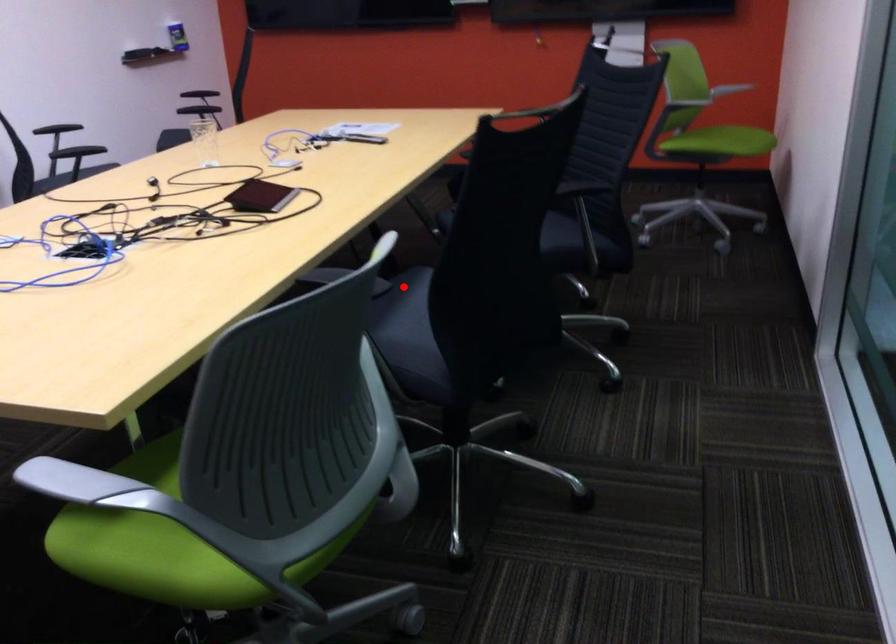
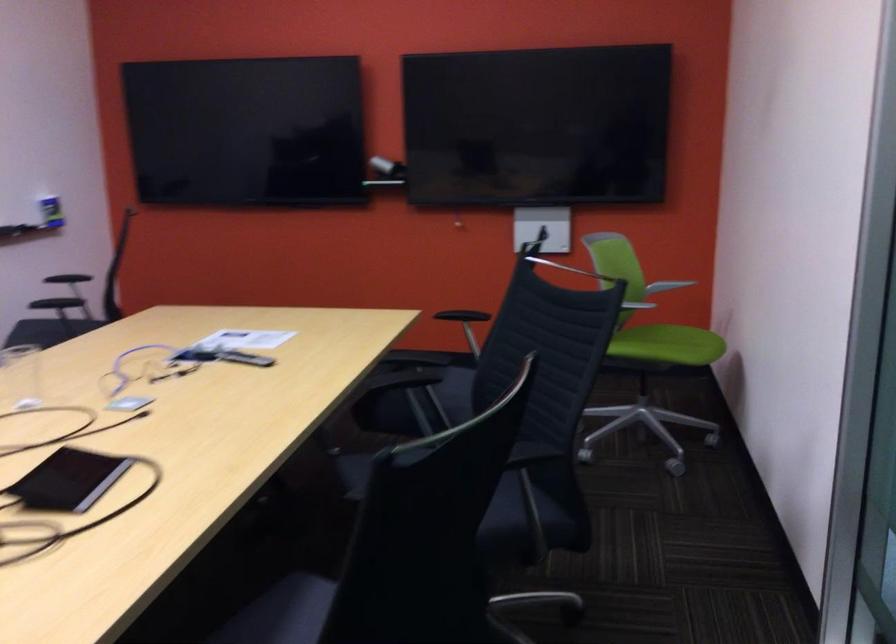
Question: I am providing you with two images of the same scene from different viewpoints. Image1 has a red point marked. In image2, the corresponding 3D location appears at what relative position? Reply with the corresponding letter.

Choices:
 (A) Closer
 (B) Farther

Answer: (A)